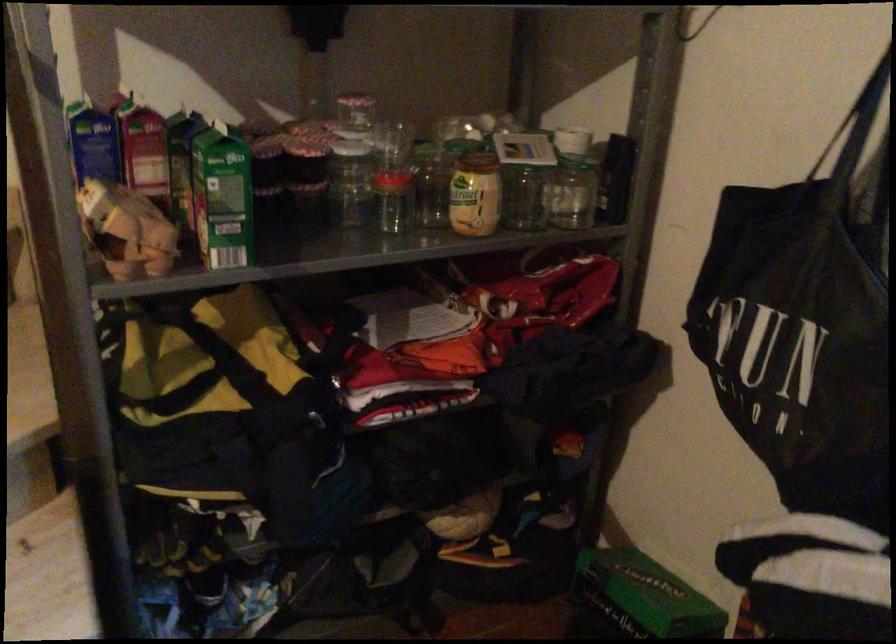
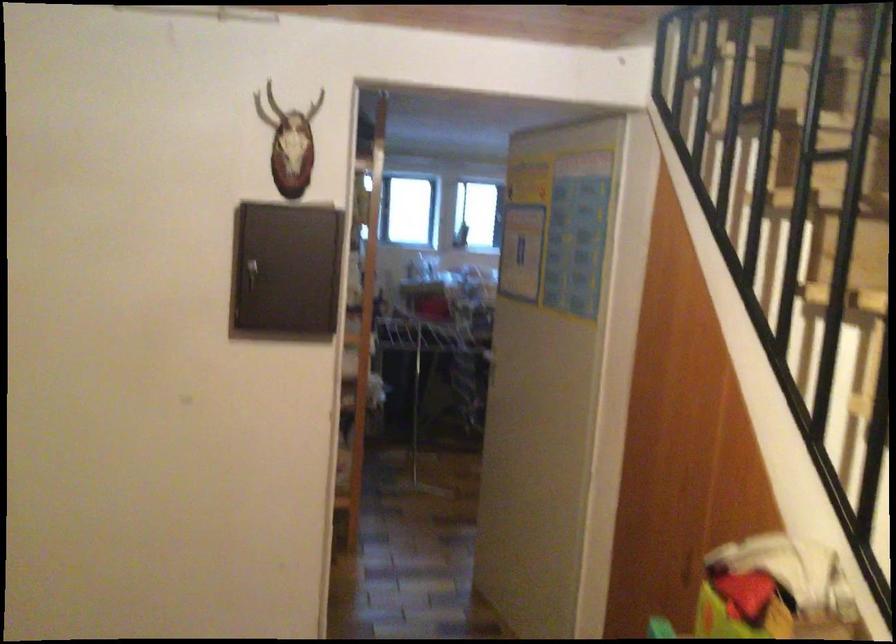
How did the camera likely rotate?

The camera rotated toward left-down.